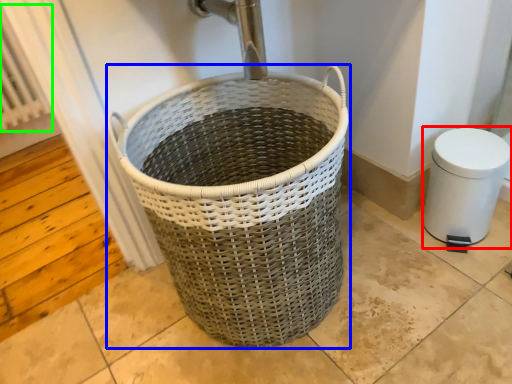
Question: Which object is positioned farthest from bidet (highlighted by a red box)? Select from waste container (highlighted by a blue box) and radiator (highlighted by a green box).

Choices:
 (A) waste container
 (B) radiator

Answer: (B)